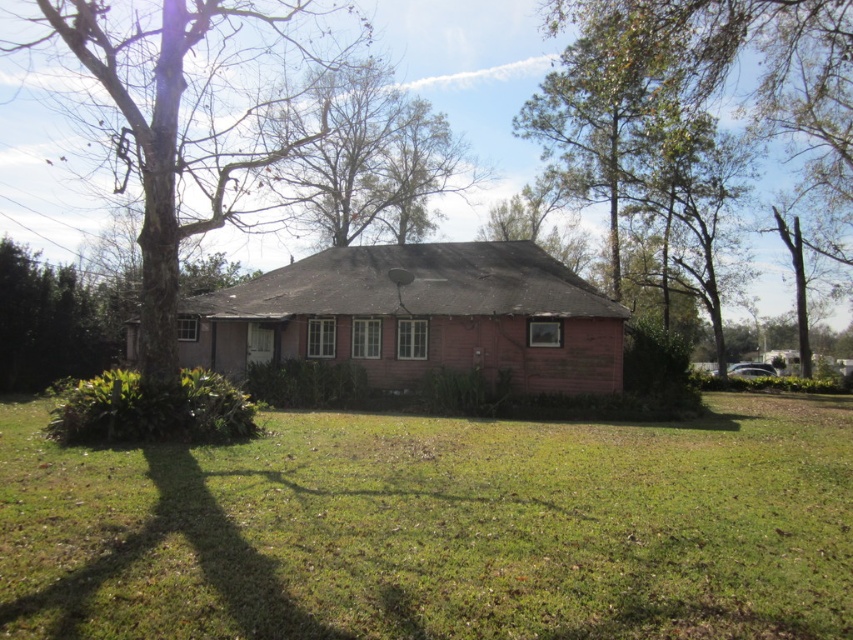
Question: Which point is farther to the camera?

Choices:
 (A) (383, 180)
 (B) (728, 0)

Answer: (A)

Question: Is brown wood tree at center bigger than green leafy tree at center?

Choices:
 (A) no
 (B) yes

Answer: (B)

Question: Which point is closer to the camera taking this photo?

Choices:
 (A) (846, 10)
 (B) (84, 620)
 (C) (158, 250)

Answer: (B)

Question: Does pink wood house at center appear on the left side of brown wood tree at center?

Choices:
 (A) yes
 (B) no

Answer: (B)

Question: Considering the real-world distances, which object is closest to the bare branches at upper center?

Choices:
 (A) green leafy tree at center
 (B) pink wood house at center
 (C) green grass at center

Answer: (B)

Question: Is pink wood house at center smaller than brown rough bark tree at left?

Choices:
 (A) no
 (B) yes

Answer: (B)